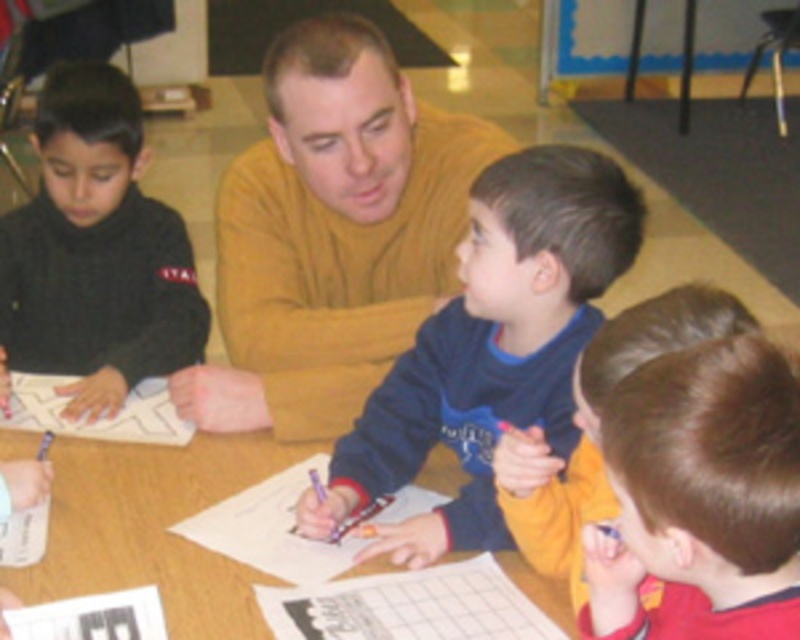
Question: Which point appears farthest from the camera in this image?

Choices:
 (A) (660, 636)
 (B) (286, 554)

Answer: (B)

Question: Estimate the real-world distances between objects in this image. Which object is closer to the white paper at center?

Choices:
 (A) black matte sweater at left
 (B) brown hair at lower right

Answer: (A)

Question: Can you confirm if black matte sweater at left is smaller than white paper at center?

Choices:
 (A) yes
 (B) no

Answer: (B)

Question: Which object appears farthest from the camera in this image?

Choices:
 (A) white paper at center
 (B) wooden table at center

Answer: (A)

Question: From the image, what is the correct spatial relationship of blue fleece sweater at center in relation to black matte sweater at left?

Choices:
 (A) below
 (B) above

Answer: (A)

Question: Is wooden table at center positioned in front of white paper at left?

Choices:
 (A) yes
 (B) no

Answer: (A)